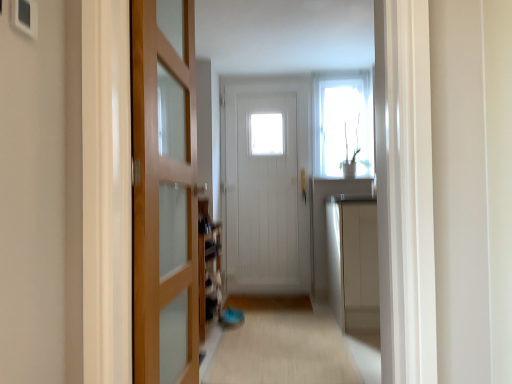
Question: From the image's perspective, is wooden door at left, which is the second door in right-to-left order, positioned above or below beige carpet at center?

Choices:
 (A) below
 (B) above

Answer: (B)

Question: Looking at their shapes, would you say wooden door at left, the first door in the left-to-right sequence, is wider or thinner than beige carpet at center?

Choices:
 (A) thin
 (B) wide

Answer: (A)

Question: Based on their relative distances, which object is farther from the white wooden door at center, the 2th door when ordered from left to right?

Choices:
 (A) beige carpet at center
 (B) wooden door at left, which is counted as the 2th door, starting from the back
 (C) white glossy window at upper center

Answer: (B)

Question: Estimate the real-world distances between objects in this image. Which object is closer to the white glossy window at upper center?

Choices:
 (A) wooden door at left, the 1th door in the front-to-back sequence
 (B) beige carpet at center
 (C) white wooden door at center, acting as the first door starting from the back

Answer: (C)